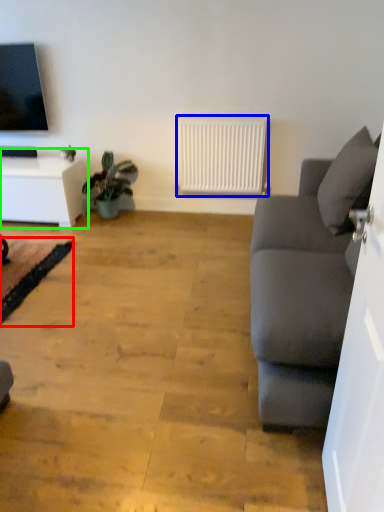
Question: Which object is the farthest from yoga mat (highlighted by a red box)? Choose among these: radiator (highlighted by a blue box) or table (highlighted by a green box).

Choices:
 (A) radiator
 (B) table

Answer: (A)